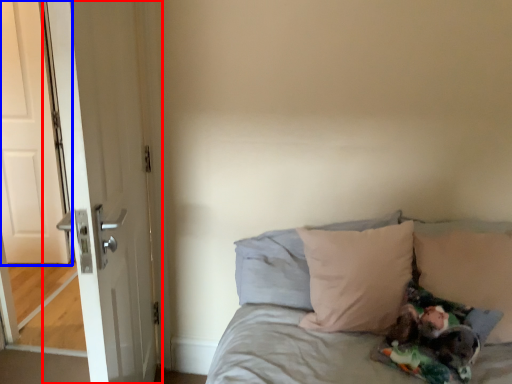
Question: Which object appears farthest to the camera in this image, door (highlighted by a red box) or door (highlighted by a blue box)?

Choices:
 (A) door
 (B) door

Answer: (B)